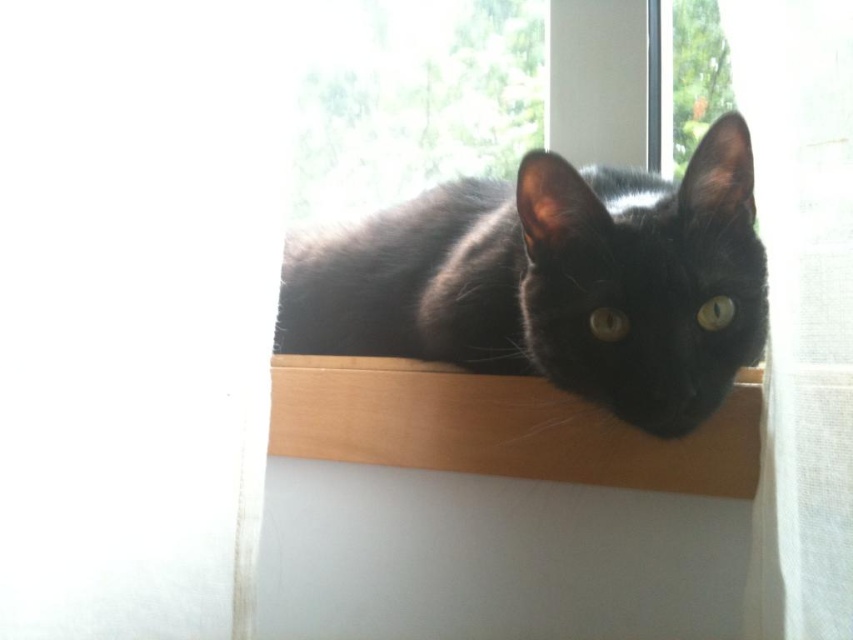
Question: Does black fur cat at center have a greater width compared to wooden shelf at center?

Choices:
 (A) yes
 (B) no

Answer: (A)

Question: Is black fur cat at center positioned before wooden shelf at center?

Choices:
 (A) no
 (B) yes

Answer: (B)

Question: Considering the relative positions of black fur cat at center and wooden shelf at center in the image provided, where is black fur cat at center located with respect to wooden shelf at center?

Choices:
 (A) left
 (B) right

Answer: (A)